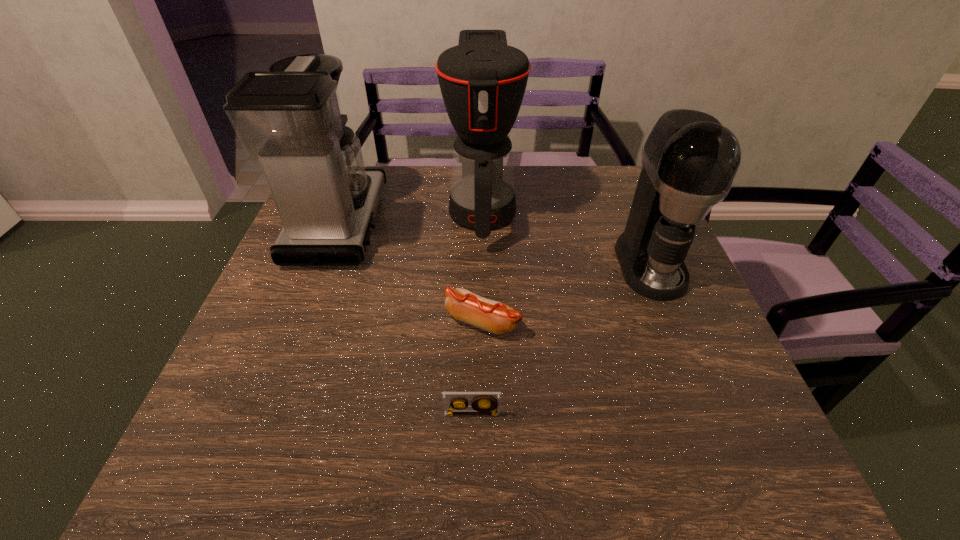
I want to click on vacant space in between the leftmost object and the second coffee maker from right to left, so click(411, 215).

The image size is (960, 540). Find the location of `free area in between the videotape and the rightmost object`. free area in between the videotape and the rightmost object is located at coordinates (561, 339).

Locate an element on the screen. vacant area that lies between the second nearest object and the second coffee maker from left to right is located at coordinates (482, 264).

This screenshot has height=540, width=960. Identify the location of vacant space in between the rightmost coffee maker and the leftmost object. (494, 244).

Identify which object is the nearest to the fourth farthest object. Please provide its 2D coordinates. Your answer should be formatted as a tuple, i.e. [(x, y)], where the tuple contains the x and y coordinates of a point satisfying the conditions above.

[(454, 403)]

Where is `the second closest object to the sausage`? the second closest object to the sausage is located at coordinates (482, 80).

Point out which coffee maker is positioned as the nearest to the second coffee maker from right to left. Please provide its 2D coordinates. Your answer should be formatted as a tuple, i.e. [(x, y)], where the tuple contains the x and y coordinates of a point satisfying the conditions above.

[(289, 118)]

Find the location of a particular element. This screenshot has width=960, height=540. coffee maker that stands as the second closest to the videotape is located at coordinates (289, 118).

Find the location of a particular element. vacant space that satisfies the following two spatial constraints: 1. at the front of the leftmost coffee maker where the controls are located; 2. on the right side of the sausage is located at coordinates (302, 322).

Identify the location of free space in the image that satisfies the following two spatial constraints: 1. at the front of the second nearest object where the controls are located; 2. on the left side of the leftmost coffee maker. This screenshot has width=960, height=540. (302, 322).